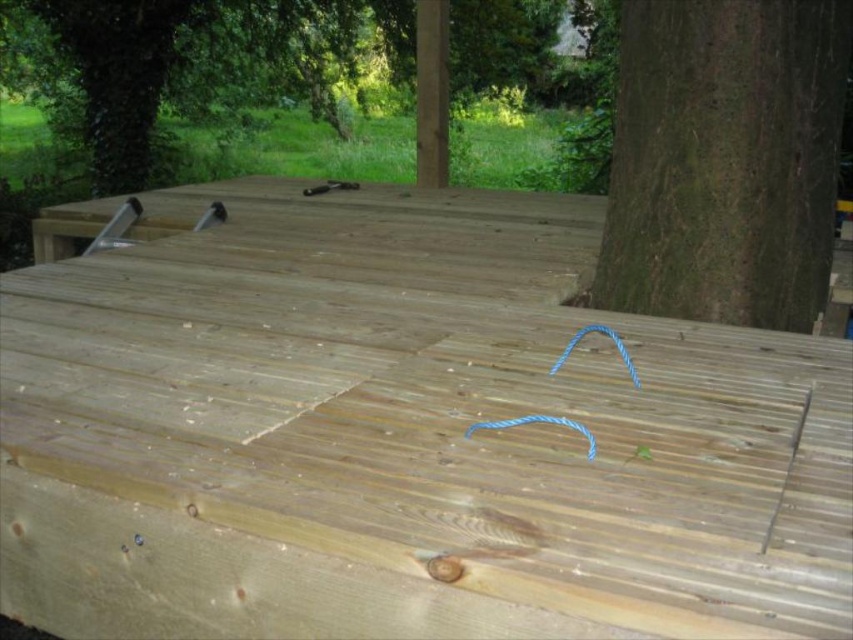
Who is shorter, natural wood deck at center or green rough bark tree at right?

With less height is green rough bark tree at right.

From the picture: Is natural wood deck at center further to camera compared to green rough bark tree at right?

No, natural wood deck at center is closer to the viewer.

Which is behind, point (701, 381) or point (669, 154)?

The point (669, 154) is behind.

The image size is (853, 640). I want to click on natural wood deck at center, so click(x=403, y=435).

Is green rough bark tree at right smaller than green rough bark tree at upper left?

Actually, green rough bark tree at right might be larger than green rough bark tree at upper left.

Between green rough bark tree at right and green rough bark tree at upper left, which one appears on the left side from the viewer's perspective?

From the viewer's perspective, green rough bark tree at upper left appears more on the left side.

The width and height of the screenshot is (853, 640). What do you see at coordinates (724, 160) in the screenshot?
I see `green rough bark tree at right` at bounding box center [724, 160].

Find the location of a particular element. The width and height of the screenshot is (853, 640). green rough bark tree at right is located at coordinates (724, 160).

Who is taller, natural wood deck at center or green rough bark tree at upper left?

natural wood deck at center is taller.

Who is more forward, (479, 548) or (67, 74)?

Point (479, 548) is more forward.

You are a GUI agent. You are given a task and a screenshot of the screen. Output one action in this format:
    pyautogui.click(x=<x>, y=<y>)
    Task: Click on the natural wood deck at center
    
    Given the screenshot: What is the action you would take?
    pyautogui.click(x=403, y=435)